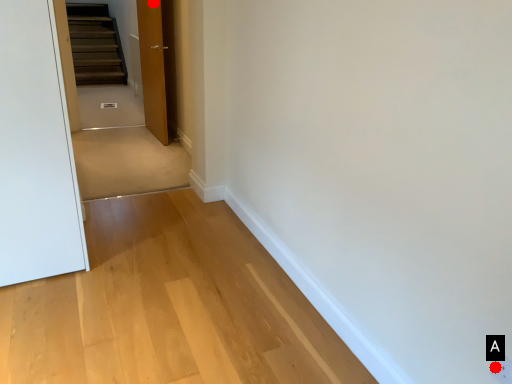
Question: Two points are circled on the image, labeled by A and B beside each circle. Which point is closer to the camera?

Choices:
 (A) A is closer
 (B) B is closer

Answer: (A)